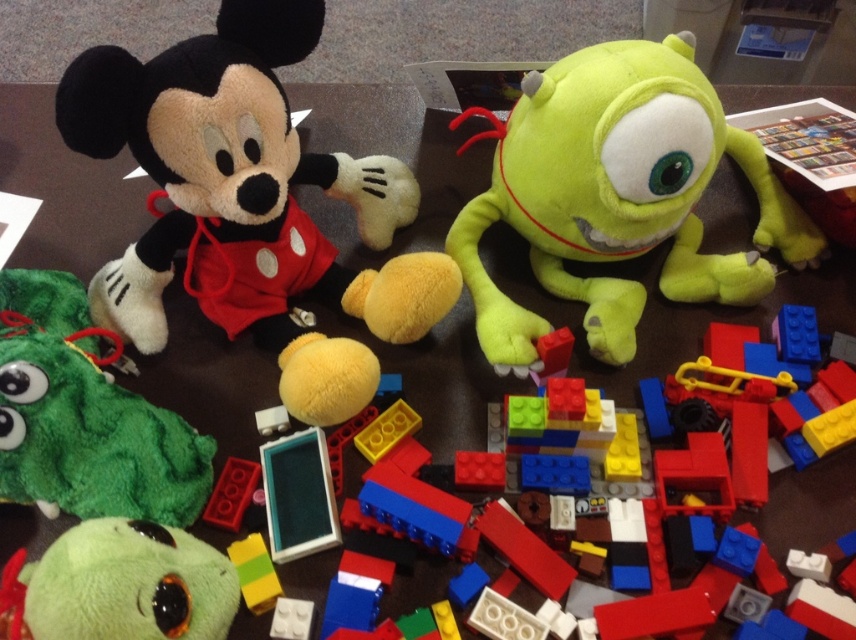
Does green fuzzy plush at lower left have a smaller size compared to green plush toy at lower left?

No, green fuzzy plush at lower left is not smaller than green plush toy at lower left.

Identify the location of green fuzzy plush at lower left. The image size is (856, 640). (85, 416).

In order to click on green fuzzy plush at lower left in this screenshot , I will do `click(85, 416)`.

What do you see at coordinates (616, 195) in the screenshot?
I see `green plush toy at center` at bounding box center [616, 195].

Is green plush toy at center to the left of green fuzzy plush at lower left from the viewer's perspective?

Incorrect, green plush toy at center is not on the left side of green fuzzy plush at lower left.

Which is in front, point (584, 323) or point (66, 442)?

Point (66, 442)

This screenshot has height=640, width=856. Find the location of `green plush toy at center`. green plush toy at center is located at coordinates (616, 195).

Can you confirm if soft plush mickey mouse at upper left is positioned below green plush toy at lower left?

Incorrect, soft plush mickey mouse at upper left is not positioned below green plush toy at lower left.

Which is in front, point (349, 385) or point (82, 609)?

Point (82, 609)

Image resolution: width=856 pixels, height=640 pixels. Identify the location of soft plush mickey mouse at upper left. (248, 204).